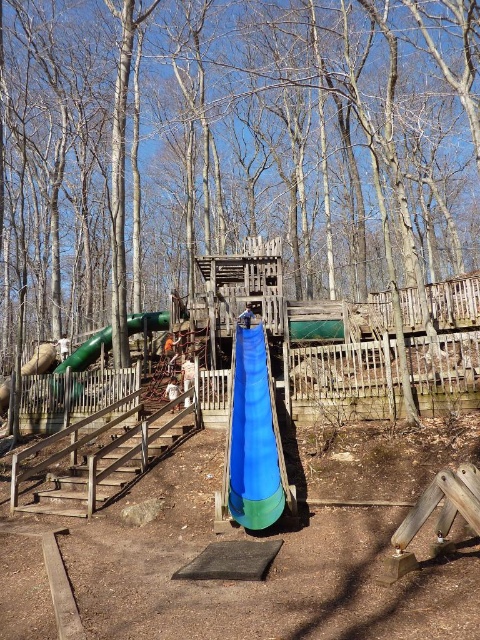
Does blue fabric slide at center appear on the right side of white fabric at center?

Correct, you'll find blue fabric slide at center to the right of white fabric at center.

Who is shorter, blue fabric slide at center or white fabric at center?

blue fabric slide at center

Does point (249, 477) come in front of point (168, 385)?

Yes, point (249, 477) is in front of point (168, 385).

Locate an element on the screen. The height and width of the screenshot is (640, 480). blue fabric slide at center is located at coordinates (252, 436).

Does green wood tree at center have a lesser width compared to white fabric at center?

No.

Between green wood tree at center and white fabric at center, which one appears on the right side from the viewer's perspective?

Positioned to the right is green wood tree at center.

Locate an element on the screen. green wood tree at center is located at coordinates (312, 140).

Locate an element on the screen. green wood tree at center is located at coordinates (312, 140).

Is point (467, 172) farther from camera compared to point (238, 476)?

Yes, point (467, 172) is farther from viewer.

The image size is (480, 640). What do you see at coordinates (312, 140) in the screenshot? I see `green wood tree at center` at bounding box center [312, 140].

You are a GUI agent. You are given a task and a screenshot of the screen. Output one action in this format:
    pyautogui.click(x=<x>, y=<y>)
    Task: Click on the green wood tree at center
    
    Given the screenshot: What is the action you would take?
    pyautogui.click(x=312, y=140)